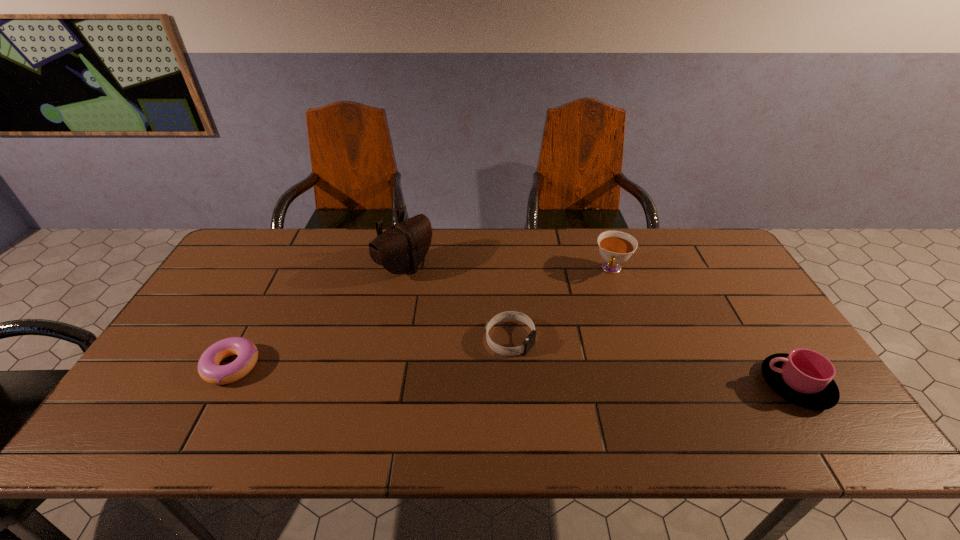
Where is `vacant space located with the flap open on the pouch`? The image size is (960, 540). vacant space located with the flap open on the pouch is located at coordinates (465, 305).

Find the location of a particular element. The height and width of the screenshot is (540, 960). teacup that is positioned at the far edge is located at coordinates (616, 247).

At what (x,y) coordinates should I click in order to perform the action: click on pouch located at the far edge. Please return your answer as a coordinate pair (x, y). Image resolution: width=960 pixels, height=540 pixels. Looking at the image, I should click on (401, 248).

Locate an element on the screen. The width and height of the screenshot is (960, 540). doughnut positioned at the near edge is located at coordinates (209, 369).

In order to click on cup that is at the near edge in this screenshot , I will do click(x=804, y=377).

Where is `object located in the left edge section of the desktop`? Image resolution: width=960 pixels, height=540 pixels. object located in the left edge section of the desktop is located at coordinates (209, 369).

This screenshot has height=540, width=960. In order to click on object located in the right edge section of the desktop in this screenshot , I will do `click(804, 377)`.

What are the coordinates of `object positioned at the near left corner` in the screenshot? It's located at (209, 369).

Identify the location of object located in the near right corner section of the desktop. This screenshot has width=960, height=540. (804, 377).

You are a GUI agent. You are given a task and a screenshot of the screen. Output one action in this format:
    pyautogui.click(x=<x>, y=<y>)
    Task: Click on the vacant space at the far edge of the desktop
    This screenshot has width=960, height=540.
    Given the screenshot: What is the action you would take?
    pyautogui.click(x=559, y=251)